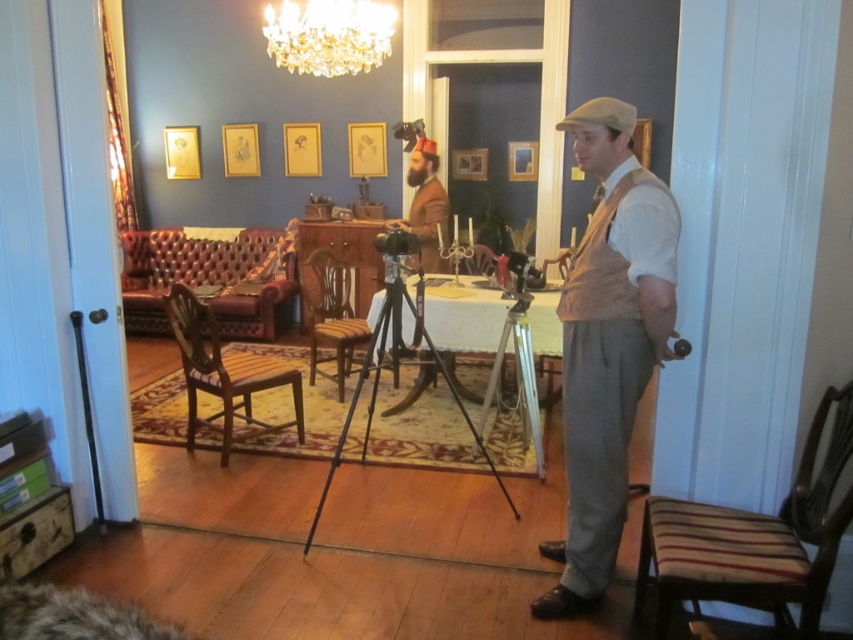
Question: Which object is the closest to the light brown fabric vest at center?

Choices:
 (A) crystal glass chandelier at upper center
 (B) striped fabric stool at lower right
 (C) black metal tripod at center
 (D) wooden stool at center

Answer: (B)

Question: Is light brown fabric vest at center thinner than wooden stool at center?

Choices:
 (A) no
 (B) yes

Answer: (B)

Question: Can you confirm if striped fabric stool at lower right is thinner than crystal glass chandelier at upper center?

Choices:
 (A) yes
 (B) no

Answer: (A)

Question: Which object is farther from the camera taking this photo?

Choices:
 (A) light brown fabric vest at center
 (B) striped fabric stool at lower right

Answer: (A)

Question: Which object is the closest to the wooden stool at center?

Choices:
 (A) black metal tripod at center
 (B) brown woolen suit at center

Answer: (B)

Question: Can you confirm if striped fabric stool at lower right is smaller than brown woolen suit at center?

Choices:
 (A) no
 (B) yes

Answer: (B)